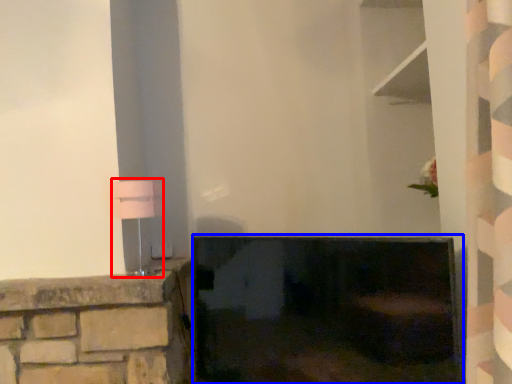
Question: Which object is closer to the camera taking this photo, table lamp (highlighted by a red box) or fireplace (highlighted by a blue box)?

Choices:
 (A) table lamp
 (B) fireplace

Answer: (B)